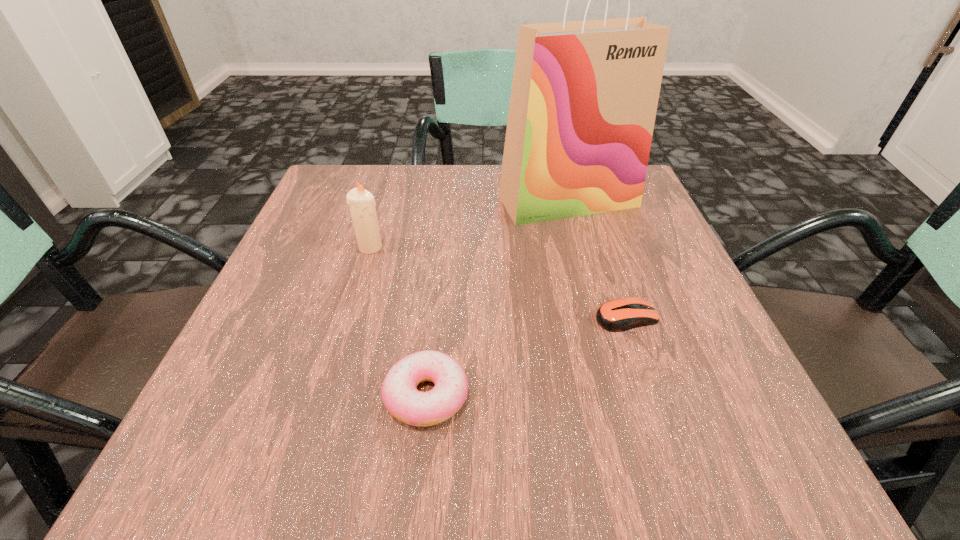
Find the location of a particular element. shopping bag is located at coordinates (584, 97).

Locate an element on the screen. This screenshot has width=960, height=540. the tallest object is located at coordinates [584, 97].

This screenshot has height=540, width=960. I want to click on the leftmost object, so click(361, 202).

This screenshot has height=540, width=960. I want to click on the second farthest object, so click(x=361, y=202).

Where is `the second object from left to right`? The width and height of the screenshot is (960, 540). the second object from left to right is located at coordinates (399, 394).

Find the location of a particular element. The height and width of the screenshot is (540, 960). doughnut is located at coordinates (399, 394).

At what (x,y) coordinates should I click in order to perform the action: click on computer mouse. Please return your answer as a coordinate pair (x, y). The image size is (960, 540). Looking at the image, I should click on (618, 315).

At what (x,y) coordinates should I click in order to perform the action: click on the second nearest object. Please return your answer as a coordinate pair (x, y). The height and width of the screenshot is (540, 960). Looking at the image, I should click on (618, 315).

Find the location of `vacant region located 0.230m on the left of the farthest object`. vacant region located 0.230m on the left of the farthest object is located at coordinates (397, 200).

Locate an element on the screen. vacant space situated on the back of the leftmost object is located at coordinates (394, 167).